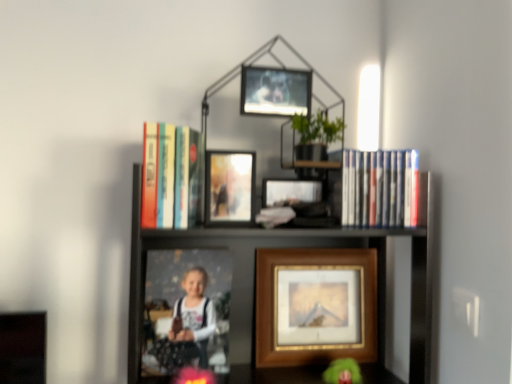
Question: Is matte plastic photo frame at center, marked as the 2th picture frame in a bottom-to-top arrangement, in front of hardcover books at upper center, acting as the second book starting from the right?

Choices:
 (A) no
 (B) yes

Answer: (A)

Question: Is matte plastic photo frame at center, marked as the 2th picture frame in a bottom-to-top arrangement, taller than hardcover books at upper center, which appears as the first book when viewed from the left?

Choices:
 (A) no
 (B) yes

Answer: (B)

Question: Is matte plastic photo frame at center, which is counted as the second picture frame, starting from the back, smaller than hardcover books at upper center, acting as the second book starting from the right?

Choices:
 (A) no
 (B) yes

Answer: (A)

Question: Is matte plastic photo frame at center, which is counted as the 3th picture frame, starting from the top, facing towards hardcover books at upper center, which appears as the first book when viewed from the left?

Choices:
 (A) yes
 (B) no

Answer: (B)

Question: Is matte plastic photo frame at center, marked as the 2th picture frame in a bottom-to-top arrangement, located outside hardcover books at upper center, acting as the second book starting from the right?

Choices:
 (A) no
 (B) yes

Answer: (B)

Question: Is hardcover books at upper center, which appears as the first book when viewed from the left, in front of or behind matte plastic dvds at upper right, the 1th book when ordered from right to left, in the image?

Choices:
 (A) front
 (B) behind

Answer: (A)

Question: From the image's perspective, relative to matte plastic dvds at upper right, the 1th book when ordered from right to left, is hardcover books at upper center, which appears as the first book when viewed from the left, above or below?

Choices:
 (A) below
 (B) above

Answer: (B)

Question: Looking at their shapes, would you say hardcover books at upper center, acting as the second book starting from the right, is wider or thinner than matte plastic dvds at upper right, the 1th book when ordered from right to left?

Choices:
 (A) wide
 (B) thin

Answer: (A)

Question: From a real-world perspective, is hardcover books at upper center, acting as the second book starting from the right, physically located above or below matte plastic dvds at upper right, acting as the 2th book starting from the left?

Choices:
 (A) below
 (B) above

Answer: (B)

Question: Considering the positions of wooden framed print at center, which is the first picture frame from back to front, and hardcover books at upper center, which appears as the first book when viewed from the left, in the image, is wooden framed print at center, which is the first picture frame from back to front, taller or shorter than hardcover books at upper center, which appears as the first book when viewed from the left,?

Choices:
 (A) tall
 (B) short

Answer: (A)

Question: In terms of width, does wooden framed print at center, which appears as the fourth picture frame when viewed from the top, look wider or thinner when compared to hardcover books at upper center, acting as the second book starting from the right?

Choices:
 (A) thin
 (B) wide

Answer: (A)

Question: Considering the positions of point (352, 269) and point (179, 206), is point (352, 269) closer or farther from the camera than point (179, 206)?

Choices:
 (A) closer
 (B) farther

Answer: (B)

Question: Relative to hardcover books at upper center, which appears as the first book when viewed from the left, is wooden framed print at center, arranged as the 1th picture frame when ordered from the bottom, in front or behind?

Choices:
 (A) behind
 (B) front

Answer: (A)

Question: Is metallic silver picture frame at upper center, marked as the 1th picture frame in a top-to-bottom arrangement, taller or shorter than matte plastic dvds at upper right, acting as the 2th book starting from the left?

Choices:
 (A) short
 (B) tall

Answer: (A)

Question: Relative to matte plastic dvds at upper right, the 1th book when ordered from right to left, is metallic silver picture frame at upper center, the fourth picture frame when ordered from bottom to top, in front or behind?

Choices:
 (A) behind
 (B) front

Answer: (B)